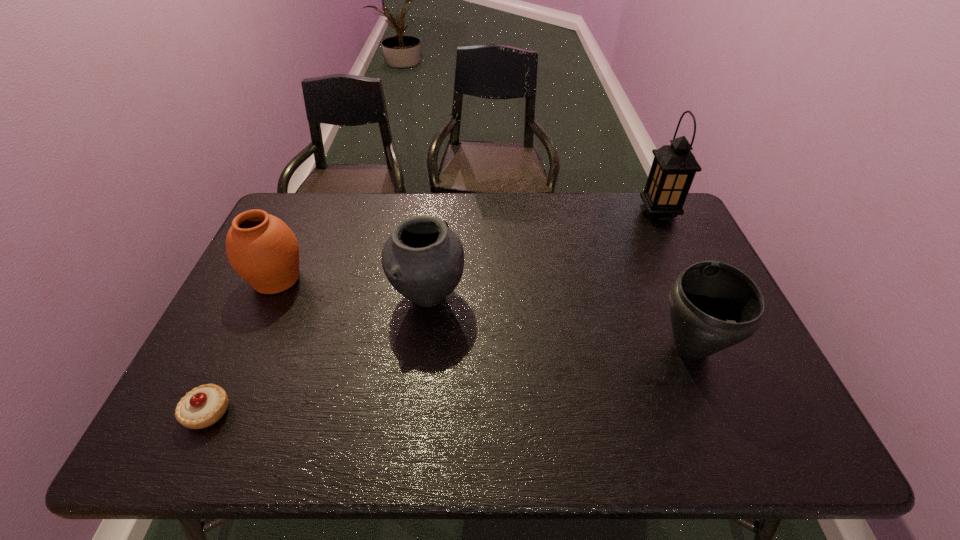
In the image, there is a desktop. Find the location of `vacant space at the far edge`. vacant space at the far edge is located at coordinates (586, 232).

You are a GUI agent. You are given a task and a screenshot of the screen. Output one action in this format:
    pyautogui.click(x=<x>, y=<y>)
    Task: Click on the vacant space at the near edge of the desktop
    The height and width of the screenshot is (540, 960).
    Given the screenshot: What is the action you would take?
    pyautogui.click(x=318, y=421)

Find the location of a particular element. Image resolution: width=960 pixels, height=540 pixels. free space at the left edge of the desktop is located at coordinates (251, 343).

Locate an element on the screen. The image size is (960, 540). vacant region at the right edge of the desktop is located at coordinates (693, 259).

Identify the location of unoccupied position between the tallest object and the shortest object. The image size is (960, 540). (433, 313).

At what (x,y) coordinates should I click in order to perform the action: click on free spot between the tallest object and the nearest object. Please return your answer as a coordinate pair (x, y). The width and height of the screenshot is (960, 540). Looking at the image, I should click on (433, 313).

Find the location of a particular element. This screenshot has height=540, width=960. free space between the rightmost urn and the farthest object is located at coordinates (674, 281).

Where is `vacant area between the second urn from right to left and the lantern`? The width and height of the screenshot is (960, 540). vacant area between the second urn from right to left and the lantern is located at coordinates (543, 255).

The width and height of the screenshot is (960, 540). What are the coordinates of `free space between the leftmost urn and the rightmost urn` in the screenshot? It's located at 484,313.

The height and width of the screenshot is (540, 960). I want to click on free space between the leftmost urn and the rightmost urn, so click(484, 313).